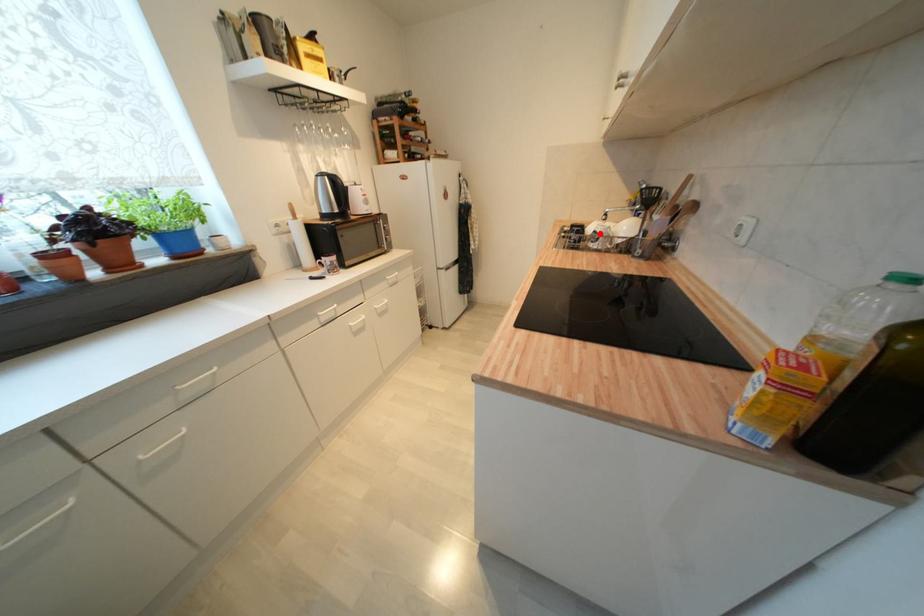
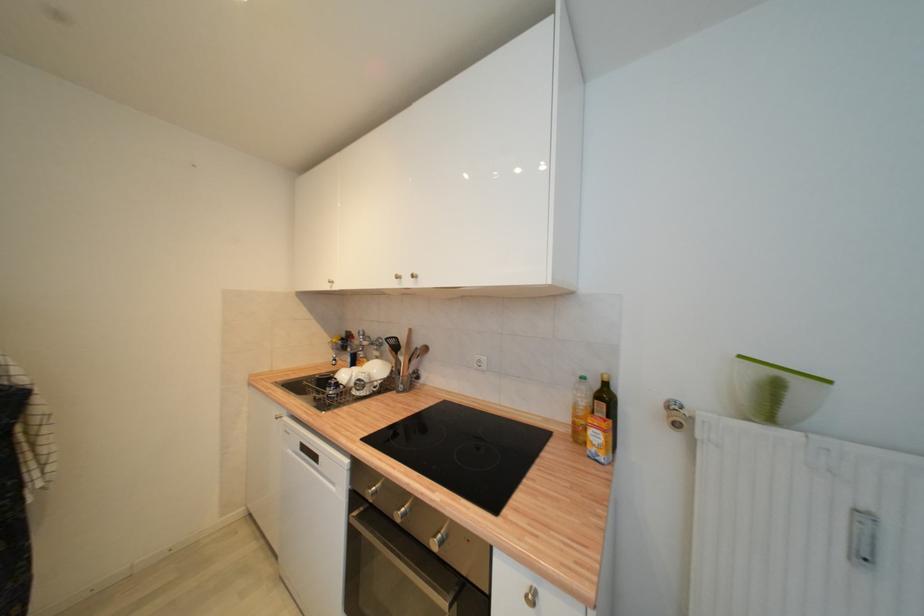
Question: I am providing you with two images of the same scene from different viewpoints. Given a red point in image1, look at the same physical point in image2. Is it:

Choices:
 (A) Closer to the viewpoint
 (B) Farther from the viewpoint

Answer: (B)